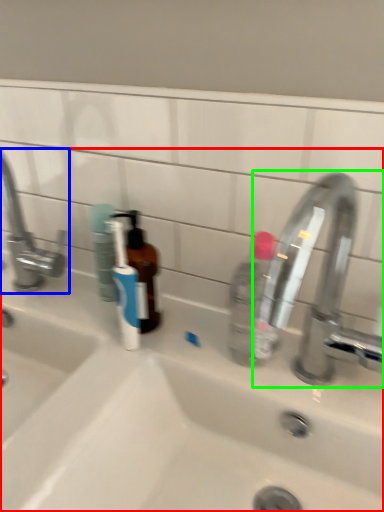
Question: Which object is the closest to the sink (highlighted by a red box)? Choose among these: tap (highlighted by a blue box) or tap (highlighted by a green box).

Choices:
 (A) tap
 (B) tap

Answer: (B)